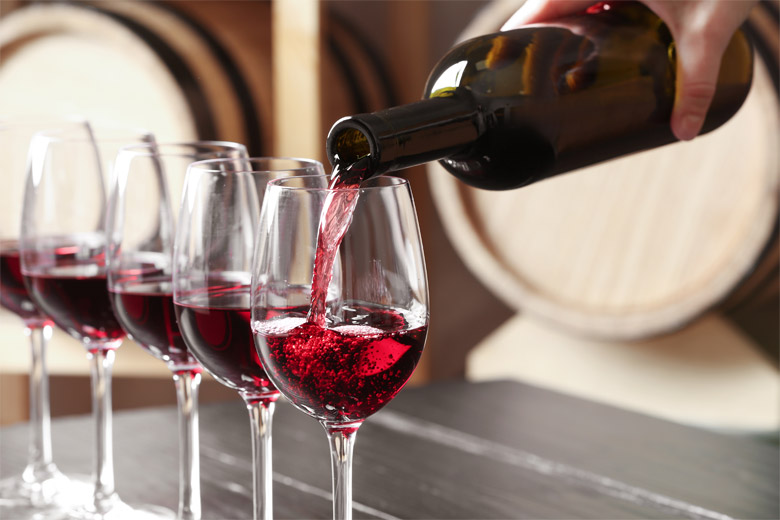
Identify the location of wine glasses. This screenshot has height=520, width=780. (339, 353), (228, 338), (135, 315), (72, 297), (12, 283).